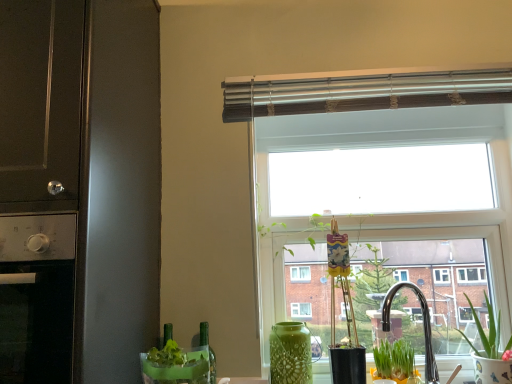
Question: From a real-world perspective, is green glass bottle at lower center physically located above or below matte black oven at left, placed as the first appliance when sorted from top to bottom?

Choices:
 (A) above
 (B) below

Answer: (B)

Question: Is green glass bottle at lower center inside or outside of matte black oven at left, placed as the first appliance when sorted from top to bottom?

Choices:
 (A) outside
 (B) inside

Answer: (A)

Question: Estimate the real-world distances between objects in this image. Which object is farther from the matte black oven at left, the second appliance positioned from the bottom?

Choices:
 (A) green matte plant at lower right, which is the 2th houseplant in right-to-left order
 (B) metallic blinds at upper center
 (C) green ceramic pot at lower right, the 1th houseplant viewed from the right
 (D) translucent green vase at lower center
 (E) transparent glass window at center

Answer: (C)

Question: Which of these objects is positioned farthest from the translucent green vase at lower center?

Choices:
 (A) transparent glass window at center
 (B) stainless steel oven at left, the first appliance when ordered from bottom to top
 (C) matte black oven at left, the second appliance positioned from the bottom
 (D) green textured vase at center
 (E) metallic blinds at upper center

Answer: (E)